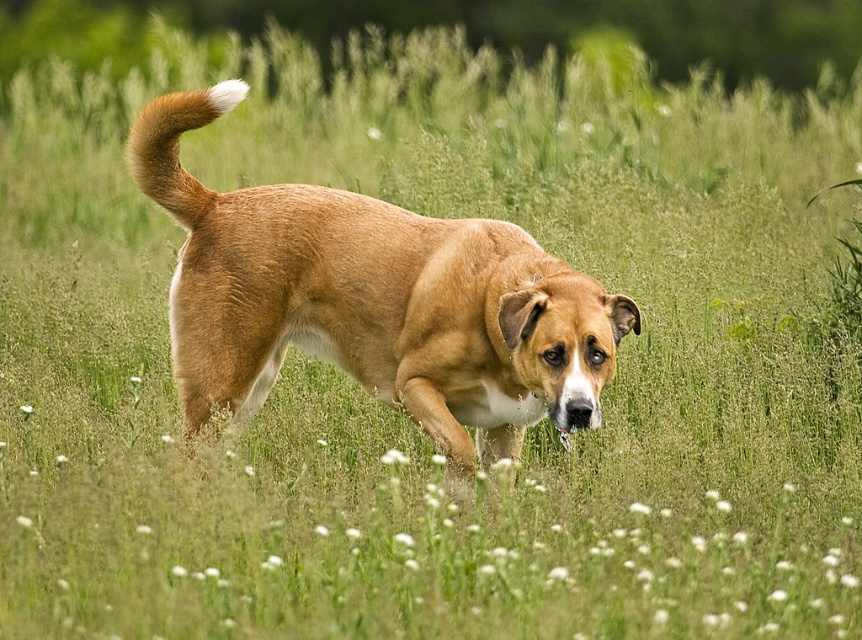
Question: Does golden fur tail at upper left appear over white fluffy flower at center?

Choices:
 (A) no
 (B) yes

Answer: (B)

Question: Is golden fur dog at center wider than golden fur tail at upper left?

Choices:
 (A) yes
 (B) no

Answer: (A)

Question: Can you confirm if golden fur tail at upper left is wider than white fluffy flower at center?

Choices:
 (A) yes
 (B) no

Answer: (A)

Question: Which object appears closest to the camera in this image?

Choices:
 (A) golden fur tail at upper left
 (B) golden fur dog at center

Answer: (B)

Question: Estimate the real-world distances between objects in this image. Which object is closer to the golden fur tail at upper left?

Choices:
 (A) white fluffy flower at center
 (B) golden fur dog at center

Answer: (B)

Question: Which of the following is the farthest from the observer?

Choices:
 (A) (182, 172)
 (B) (22, 410)

Answer: (B)